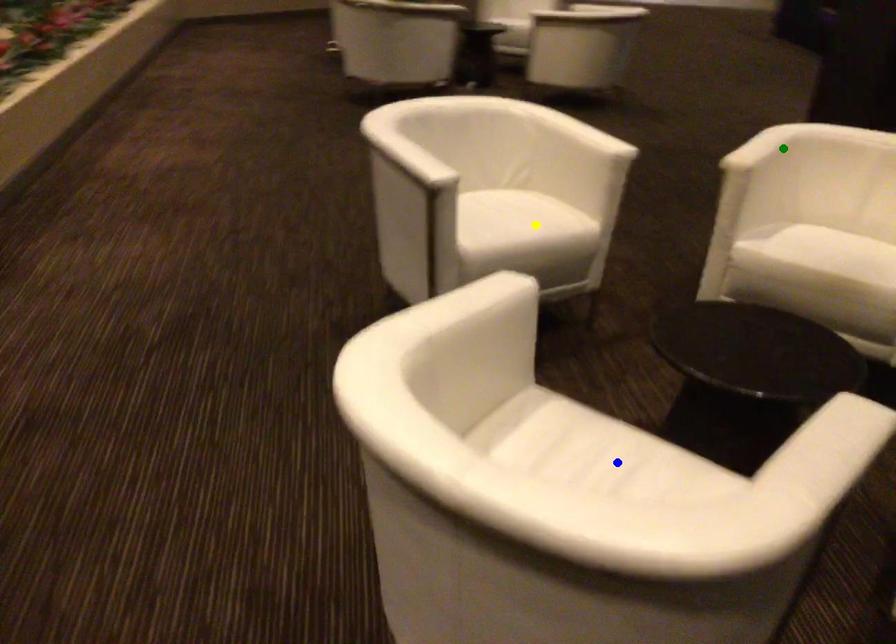
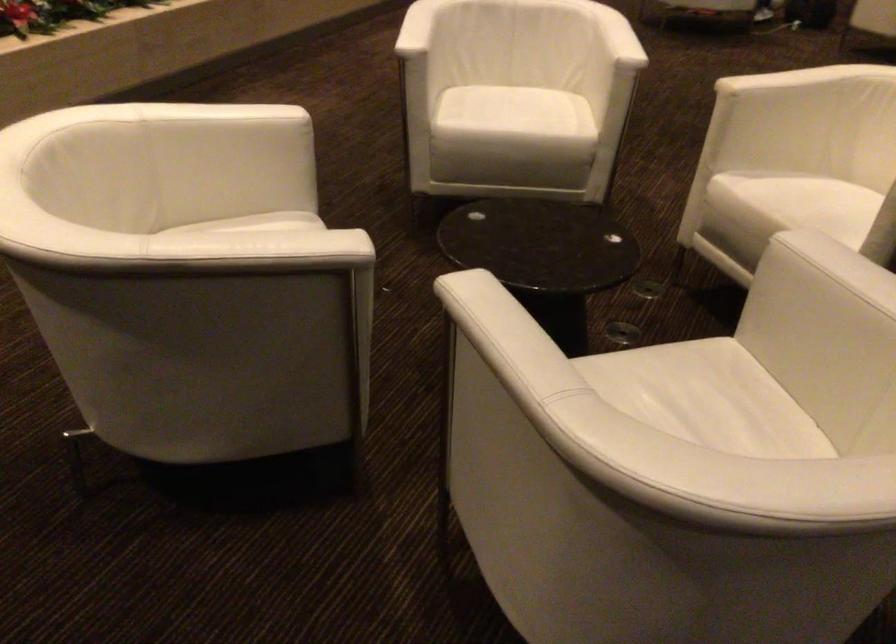
I am providing you with two images of the same scene from different viewpoints. Three points are marked in image1. Which point corresponds to a part or object that is occluded in image2?In image1, three points are marked. Which of them correspond to a part or object that is occluded in image2?Among the three points shown in image1, which one corresponds to a part or object that is no longer visible due to occlusion in image2?

Invisible in image2: blue point.